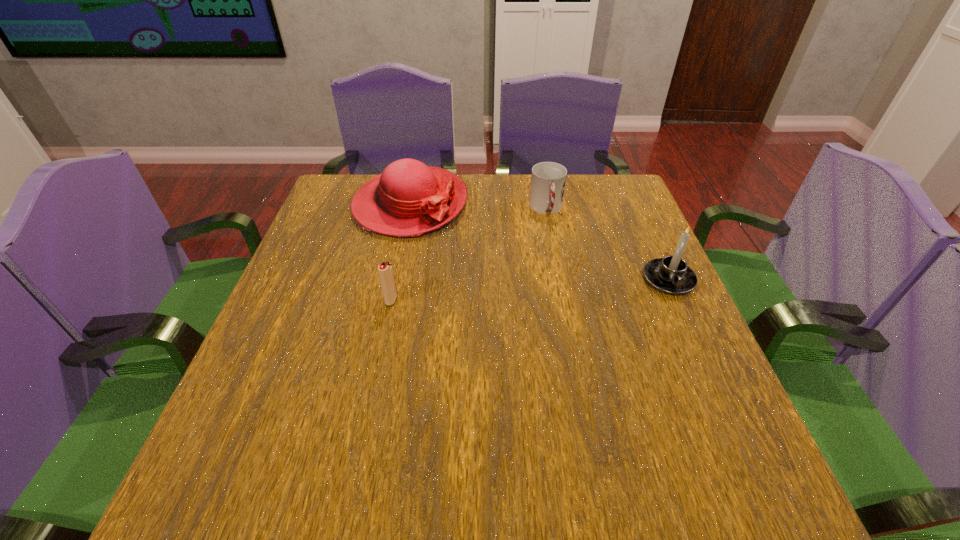
Find the location of a particular element. This screenshot has width=960, height=540. igniter is located at coordinates (385, 269).

Image resolution: width=960 pixels, height=540 pixels. What are the coordinates of `candle holder` in the screenshot? It's located at (671, 275).

Find the location of a particular element. This screenshot has width=960, height=540. the rightmost object is located at coordinates (671, 275).

What are the coordinates of `the second tallest object` in the screenshot? It's located at (408, 198).

Locate an element on the screen. The width and height of the screenshot is (960, 540). the third object from left to right is located at coordinates (548, 179).

You are a GUI agent. You are given a task and a screenshot of the screen. Output one action in this format:
    pyautogui.click(x=<x>, y=<y>)
    Task: Click on the blank space located 0.200m on the right of the igniter
    This screenshot has width=960, height=540.
    Given the screenshot: What is the action you would take?
    pyautogui.click(x=487, y=300)

Where is `blank area located 0.140m with a handle on the side of the rightmost object`? Image resolution: width=960 pixels, height=540 pixels. blank area located 0.140m with a handle on the side of the rightmost object is located at coordinates (700, 349).

Image resolution: width=960 pixels, height=540 pixels. Identify the location of vacant space located 0.140m at the front of the hat with a bow. (467, 264).

What are the coordinates of `free space located at the front of the hat with a bow` in the screenshot? It's located at (475, 273).

Where is `free space located 0.270m at the front of the hat with a bow`? free space located 0.270m at the front of the hat with a bow is located at coordinates (496, 296).